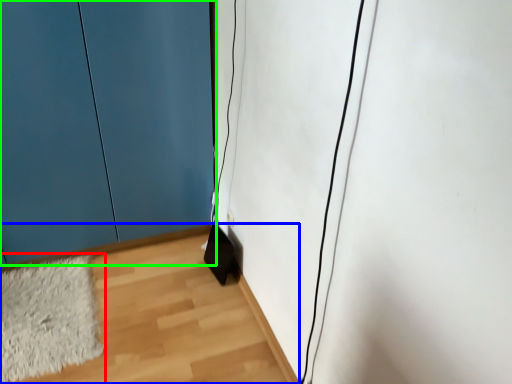
Question: Which is nearer to the mat (highlighted by a red box)? corridor (highlighted by a blue box) or door (highlighted by a green box).

Choices:
 (A) corridor
 (B) door

Answer: (A)